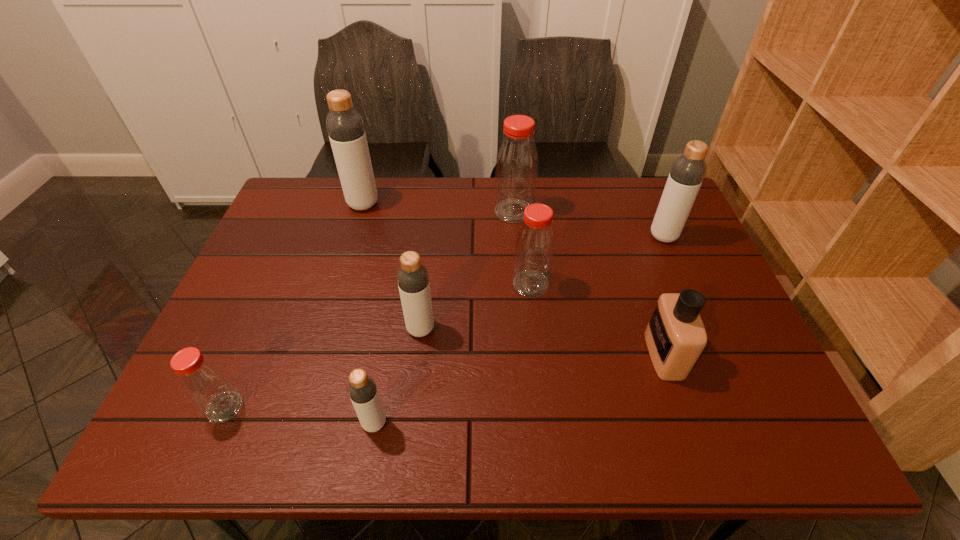
Where is `vacant area that satisfies the following two spatial constraints: 1. on the back side of the third nearest bottle; 2. on the right side of the second farthest red bottle`? This screenshot has height=540, width=960. vacant area that satisfies the following two spatial constraints: 1. on the back side of the third nearest bottle; 2. on the right side of the second farthest red bottle is located at coordinates (426, 284).

At what (x,y) coordinates should I click in order to perform the action: click on free spot that satisfies the following two spatial constraints: 1. on the back side of the fifth nearest object; 2. on the left side of the nearest gray bottle. Please return your answer as a coordinate pair (x, y). Looking at the image, I should click on (398, 284).

This screenshot has height=540, width=960. I want to click on free space that satisfies the following two spatial constraints: 1. on the back side of the leftmost bottle; 2. on the left side of the fourth bottle from left to right, so click(x=258, y=329).

At what (x,y) coordinates should I click in order to perform the action: click on blank space that satisfies the following two spatial constraints: 1. on the front side of the biggest red bottle; 2. on the left side of the biggest gray bottle. Please return your answer as a coordinate pair (x, y). Looking at the image, I should click on (361, 211).